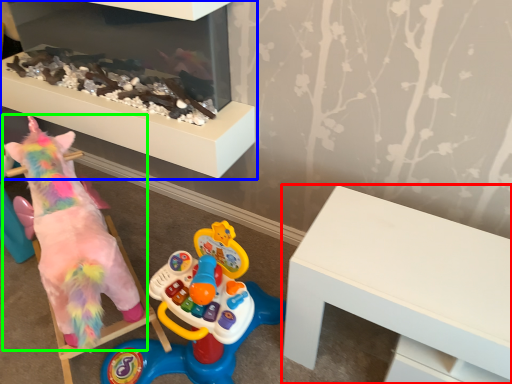
Question: Estimate the real-world distances between objects in this image. Which object is farther from table (highlighted by a red box), furniture (highlighted by a blue box) or toy (highlighted by a green box)?

Choices:
 (A) furniture
 (B) toy

Answer: (A)